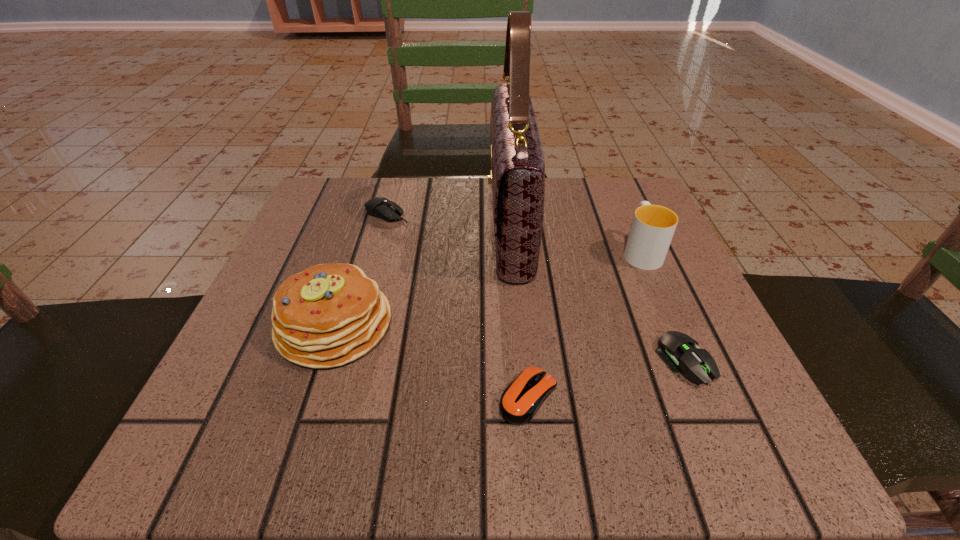
Locate an element on the screen. This screenshot has height=540, width=960. vacant space at the far left corner of the desktop is located at coordinates (328, 181).

The width and height of the screenshot is (960, 540). I want to click on vacant space at the far right corner of the desktop, so click(571, 186).

The width and height of the screenshot is (960, 540). Find the location of `free space at the near right corner`. free space at the near right corner is located at coordinates (735, 419).

I want to click on vacant point located between the pancake and the handbag, so tap(422, 275).

The height and width of the screenshot is (540, 960). Find the location of `free spot between the pancake and the rightmost computer mouse`. free spot between the pancake and the rightmost computer mouse is located at coordinates (509, 343).

The height and width of the screenshot is (540, 960). What are the coordinates of `free space between the tallest object and the second computer mouse from right to left` in the screenshot? It's located at (519, 310).

The image size is (960, 540). In order to click on free space that is in between the rightmost computer mouse and the tallest object in this screenshot , I will do tap(597, 293).

Locate an element on the screen. Image resolution: width=960 pixels, height=540 pixels. empty space between the pancake and the rightmost computer mouse is located at coordinates (509, 343).

At what (x,y) coordinates should I click in order to perform the action: click on free spot between the handbag and the pancake. Please return your answer as a coordinate pair (x, y). The height and width of the screenshot is (540, 960). Looking at the image, I should click on (422, 275).

This screenshot has height=540, width=960. Identify the location of free space between the rightmost computer mouse and the cup. (662, 306).